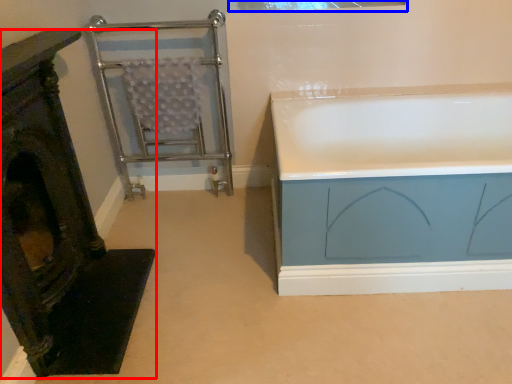
Question: Which object appears closest to the camera in this image, furniture (highlighted by a red box) or window (highlighted by a blue box)?

Choices:
 (A) furniture
 (B) window

Answer: (A)